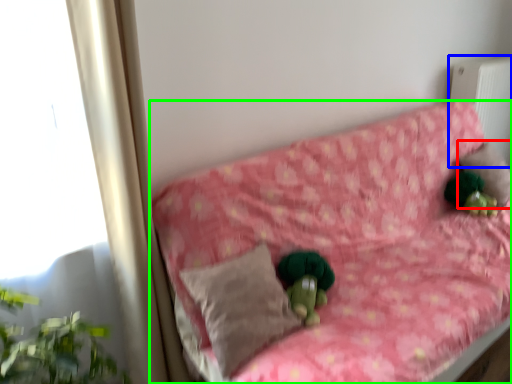
Question: Which object is the farthest from pillow (highlighted by a red box)? Choose among these: radiator (highlighted by a blue box) or furniture (highlighted by a green box).

Choices:
 (A) radiator
 (B) furniture

Answer: (B)